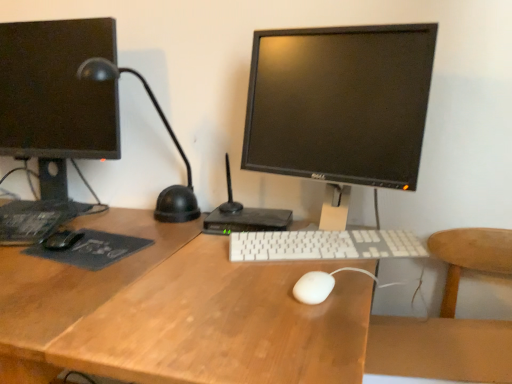
Find the location of `free space to the back side of white matte mouse at center, which appears as the first mouse when viewed from the front`. free space to the back side of white matte mouse at center, which appears as the first mouse when viewed from the front is located at coordinates (301, 256).